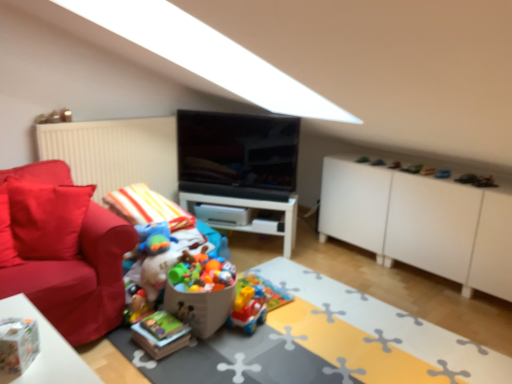
Question: Would you say black glossy tv at center is outside plastic colorful toy car at center, positioned as the 2th toy in left-to-right order?

Choices:
 (A) yes
 (B) no

Answer: (A)

Question: Is black glossy tv at center positioned far away from plastic colorful toy car at center, positioned as the 2th toy in left-to-right order?

Choices:
 (A) yes
 (B) no

Answer: (A)

Question: Is black glossy tv at center touching plastic colorful toy car at center, positioned as the 2th toy in left-to-right order?

Choices:
 (A) no
 (B) yes

Answer: (A)

Question: Is black glossy tv at center turned away from plastic colorful toy car at center, positioned as the 2th toy in left-to-right order?

Choices:
 (A) yes
 (B) no

Answer: (B)

Question: Does black glossy tv at center have a lesser height compared to plastic colorful toy car at center, placed as the 1th toy when sorted from right to left?

Choices:
 (A) yes
 (B) no

Answer: (B)

Question: Visually, is plastic toy train at center positioned to the left or to the right of white matte cabinet at right?

Choices:
 (A) right
 (B) left

Answer: (B)

Question: Based on their sizes in the image, would you say plastic toy train at center is bigger or smaller than white matte cabinet at right?

Choices:
 (A) small
 (B) big

Answer: (A)

Question: In terms of height, does plastic toy train at center look taller or shorter compared to white matte cabinet at right?

Choices:
 (A) short
 (B) tall

Answer: (A)

Question: In the image, is plastic toy train at center positioned in front of or behind white matte cabinet at right?

Choices:
 (A) behind
 (B) front

Answer: (B)

Question: From a real-world perspective, relative to white matte cabinet at right, is white glossy table at center vertically above or below?

Choices:
 (A) above
 (B) below

Answer: (B)

Question: From the image's perspective, is white glossy table at center positioned above or below white matte cabinet at right?

Choices:
 (A) above
 (B) below

Answer: (B)

Question: Is white glossy table at center in front of or behind white matte cabinet at right in the image?

Choices:
 (A) front
 (B) behind

Answer: (B)

Question: Visually, is white glossy table at center positioned to the left or to the right of white matte cabinet at right?

Choices:
 (A) left
 (B) right

Answer: (A)

Question: Based on their sizes in the image, would you say white glossy table at center is bigger or smaller than plastic colorful toy car at center, positioned as the 2th toy in left-to-right order?

Choices:
 (A) big
 (B) small

Answer: (A)

Question: From their relative heights in the image, would you say white glossy table at center is taller or shorter than plastic colorful toy car at center, positioned as the 2th toy in left-to-right order?

Choices:
 (A) short
 (B) tall

Answer: (B)